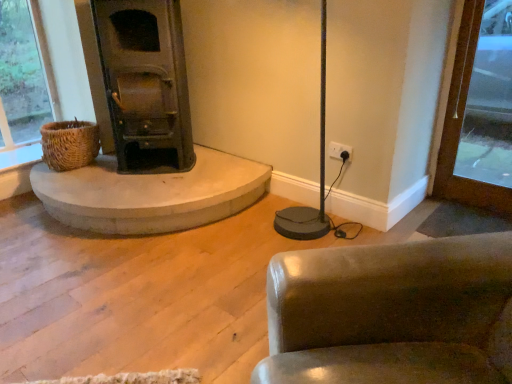
Question: Would you say dark green metal wood burning stove at left is part of leather-like brown chair at lower right's contents?

Choices:
 (A) yes
 (B) no

Answer: (B)

Question: Is leather-like brown chair at lower right taller than dark green metal wood burning stove at left?

Choices:
 (A) yes
 (B) no

Answer: (B)

Question: Considering the relative sizes of leather-like brown chair at lower right and dark green metal wood burning stove at left in the image provided, is leather-like brown chair at lower right thinner than dark green metal wood burning stove at left?

Choices:
 (A) no
 (B) yes

Answer: (A)

Question: From a real-world perspective, is leather-like brown chair at lower right below dark green metal wood burning stove at left?

Choices:
 (A) no
 (B) yes

Answer: (B)

Question: Is leather-like brown chair at lower right shorter than dark green metal wood burning stove at left?

Choices:
 (A) yes
 (B) no

Answer: (A)

Question: In terms of width, does woven brown basket at left look wider or thinner when compared to brown wood door at right?

Choices:
 (A) wide
 (B) thin

Answer: (A)

Question: Is woven brown basket at left situated inside brown wood door at right or outside?

Choices:
 (A) outside
 (B) inside

Answer: (A)

Question: From a real-world perspective, is woven brown basket at left above or below brown wood door at right?

Choices:
 (A) above
 (B) below

Answer: (B)

Question: Is woven brown basket at left in front of or behind brown wood door at right in the image?

Choices:
 (A) front
 (B) behind

Answer: (B)

Question: Based on their positions, is dark green metal wood burning stove at left located to the left or right of leather-like brown chair at lower right?

Choices:
 (A) right
 (B) left

Answer: (B)

Question: Relative to leather-like brown chair at lower right, is dark green metal wood burning stove at left in front or behind?

Choices:
 (A) front
 (B) behind

Answer: (B)

Question: Is dark green metal wood burning stove at left wider or thinner than leather-like brown chair at lower right?

Choices:
 (A) wide
 (B) thin

Answer: (B)

Question: In terms of height, does dark green metal wood burning stove at left look taller or shorter compared to leather-like brown chair at lower right?

Choices:
 (A) short
 (B) tall

Answer: (B)

Question: Considering the positions of brown wood door at right and leather-like brown chair at lower right in the image, is brown wood door at right taller or shorter than leather-like brown chair at lower right?

Choices:
 (A) tall
 (B) short

Answer: (A)

Question: In the image, is brown wood door at right positioned in front of or behind leather-like brown chair at lower right?

Choices:
 (A) behind
 (B) front

Answer: (A)